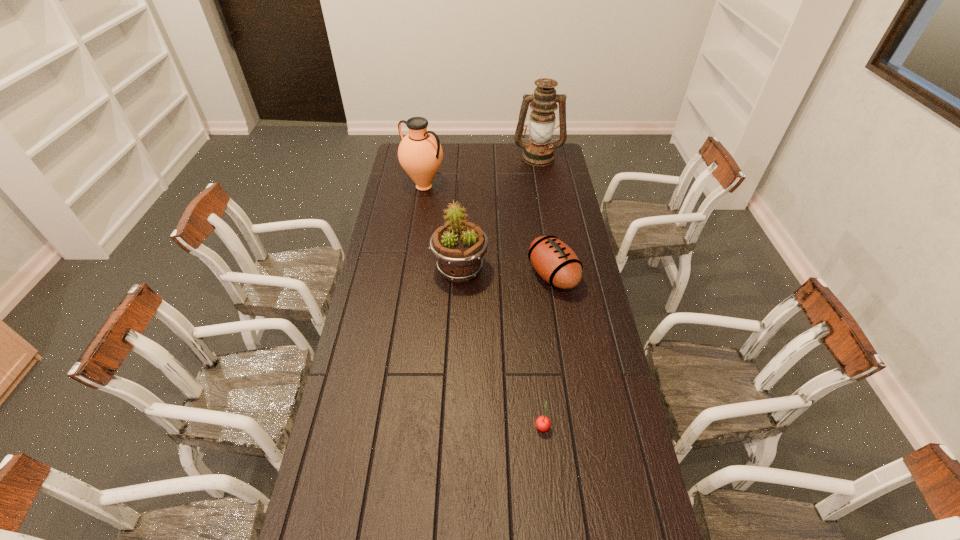
At what (x,y) coordinates should I click in order to perform the action: click on lantern. Please return your answer as a coordinate pair (x, y). Looking at the image, I should click on (538, 152).

The width and height of the screenshot is (960, 540). What are the coordinates of `the tallest object` in the screenshot? It's located at (538, 152).

The image size is (960, 540). Identify the location of the second farthest object. (420, 153).

Where is `flowerpot`? flowerpot is located at coordinates (459, 246).

Where is `the fourth tallest object`? The width and height of the screenshot is (960, 540). the fourth tallest object is located at coordinates (554, 261).

This screenshot has height=540, width=960. Find the location of `the shortest object`. the shortest object is located at coordinates (543, 423).

The width and height of the screenshot is (960, 540). I want to click on the nearest object, so click(543, 423).

Locate an element on the screen. free space located 0.150m on the front of the farthest object is located at coordinates (542, 183).

Identify the location of vacant space located on the right of the pitcher. This screenshot has width=960, height=540. (500, 186).

The width and height of the screenshot is (960, 540). In order to click on vacant point located on the front of the flowerpot in this screenshot , I will do `click(457, 348)`.